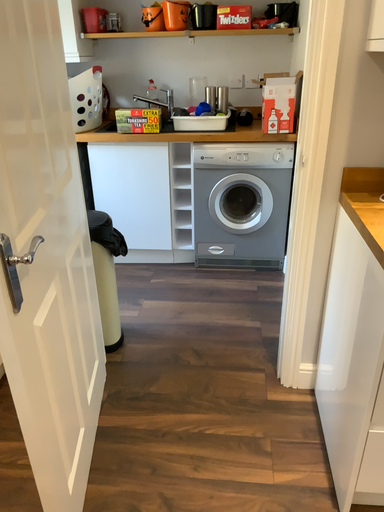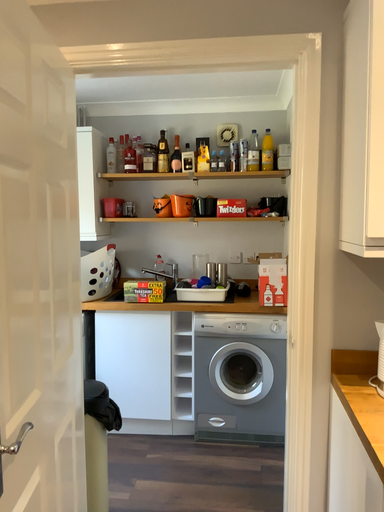
Question: How did the camera likely rotate when shooting the video?

Choices:
 (A) rotated downward
 (B) rotated upward

Answer: (B)